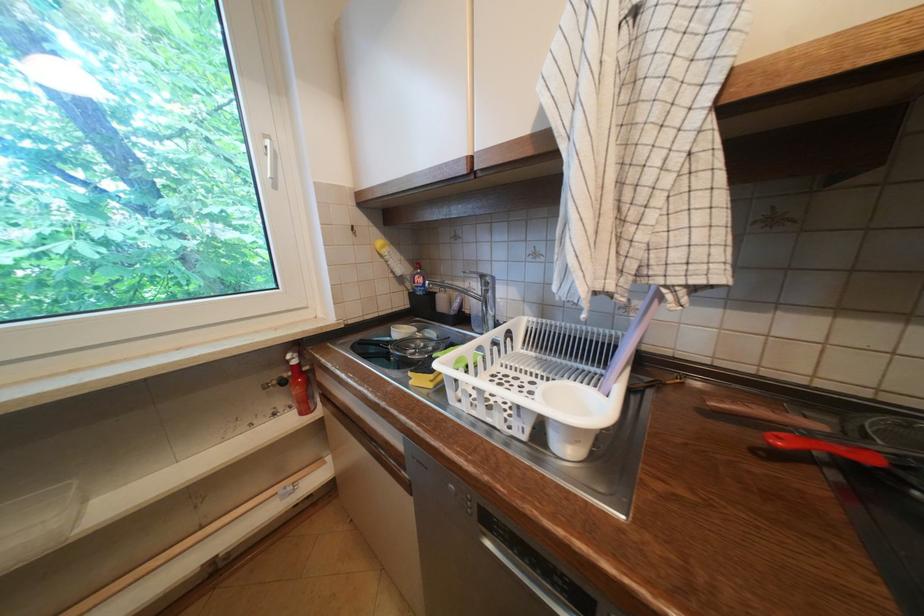
Where is `small white bowl`? small white bowl is located at coordinates (577, 415).